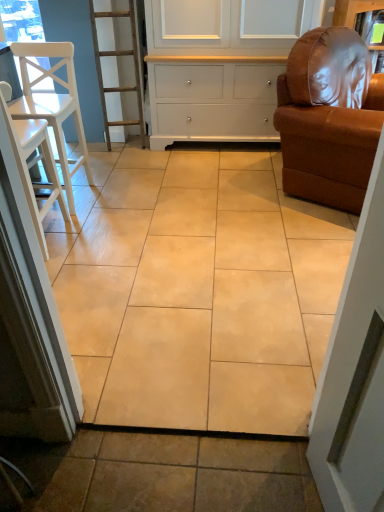
Question: Is point (69, 65) positioned closer to the camera than point (41, 240)?

Choices:
 (A) closer
 (B) farther

Answer: (B)

Question: Is white wood chair at left, which is counted as the 1th chair, starting from the left, inside the boundaries of white wood chair at left, the second chair viewed from the right, or outside?

Choices:
 (A) outside
 (B) inside

Answer: (A)

Question: Which is nearer to the white wood chair at left, which is counted as the 1th chair, starting from the left?

Choices:
 (A) beige ceramic tile at center
 (B) white wood chair at left, the second chair viewed from the right
 (C) brown leather armchair at right, placed as the 1th chair when sorted from right to left
 (D) white painted wood cabinet at upper center

Answer: (B)

Question: Based on their relative distances, which object is farther from the white wood chair at left, the second chair viewed from the right?

Choices:
 (A) white painted wood cabinet at upper center
 (B) white wood chair at left, the 3th chair from the right
 (C) brown leather armchair at right, the third chair in the left-to-right sequence
 (D) beige ceramic tile at center

Answer: (C)